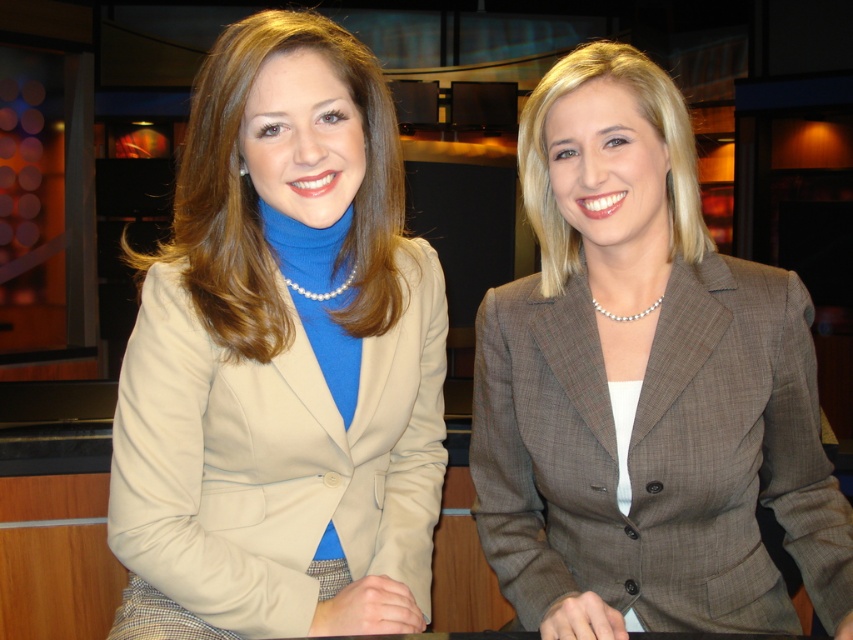
Question: Is matte beige blazer at center to the right of gray plaid blazer at center from the viewer's perspective?

Choices:
 (A) yes
 (B) no

Answer: (B)

Question: Is matte beige blazer at center positioned behind gray plaid blazer at center?

Choices:
 (A) no
 (B) yes

Answer: (B)

Question: Among these points, which one is farthest from the camera?

Choices:
 (A) (315, 376)
 (B) (476, 486)

Answer: (B)

Question: Does matte beige blazer at center come in front of gray plaid blazer at center?

Choices:
 (A) yes
 (B) no

Answer: (B)